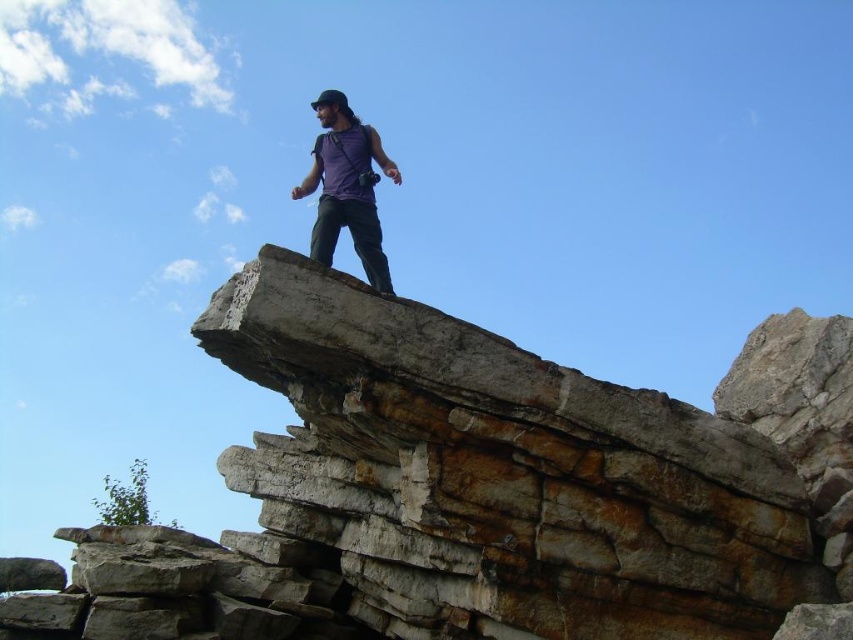
You are a photographer trying to capture the rusty stone cliff at center and the purple matte tank top at center in a single frame. Based on their positions, which object should you focus on first to ensure both are in sharp focus?

The rusty stone cliff at center is in front of the purple matte tank top at center. To ensure both are in sharp focus, you should focus on the rusty stone cliff at center first since it is closer to the camera, allowing the depth of field to extend backward to the farther object.

You are a photographer trying to capture the best angle of the layered rock formation. You notice two points marked on the rocks. Which point is closer to your camera lens? Please choose between point (463, 371) and point (325, 147).

Point (463, 371) is closer to the viewer than point (325, 147), so you should aim your camera lens towards point (463, 371) to capture it more prominently.